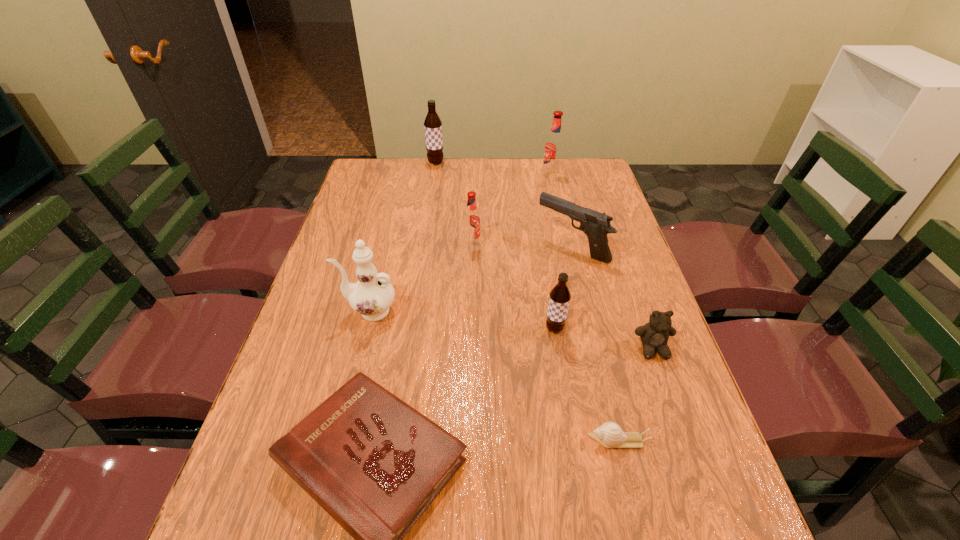
Find the location of a particular element. black gun is located at coordinates (596, 225).

Locate an element on the screen. The height and width of the screenshot is (540, 960). brown teddy bear is located at coordinates (654, 335).

I want to click on the third shortest object, so click(654, 335).

Where is `escargot`? The height and width of the screenshot is (540, 960). escargot is located at coordinates (610, 435).

Locate an element on the screen. free spot located on the right of the left brown root beer is located at coordinates (516, 163).

At what (x,y) coordinates should I click in order to perform the action: click on vacant space located 0.230m on the left of the rightmost root beer. Please return your answer as a coordinate pair (x, y). This screenshot has width=960, height=540. Looking at the image, I should click on (480, 175).

Where is `vacant region located at the spout of the chinaware`? This screenshot has height=540, width=960. vacant region located at the spout of the chinaware is located at coordinates (306, 310).

Identify the location of vacant region located 0.180m on the front of the third farthest root beer. This screenshot has height=540, width=960. (471, 291).

Locate an element on the screen. The height and width of the screenshot is (540, 960). blank space located on the front of the right brown root beer is located at coordinates tap(573, 442).

At what (x,y) coordinates should I click in order to perform the action: click on vacant space located 0.310m at the muzzle of the sixth tallest object. Please return your answer as a coordinate pair (x, y). Image resolution: width=960 pixels, height=540 pixels. Looking at the image, I should click on (435, 247).